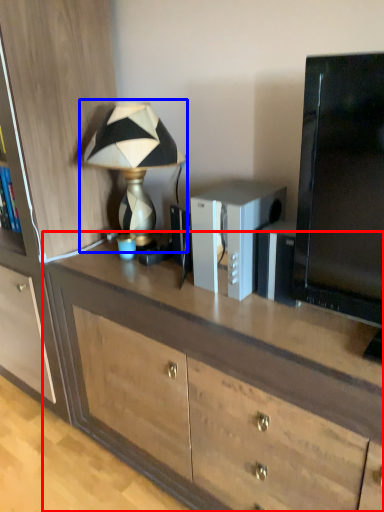
Question: Which of the following is the closest to the observer, desk (highlighted by a red box) or lamp (highlighted by a blue box)?

Choices:
 (A) desk
 (B) lamp

Answer: (A)